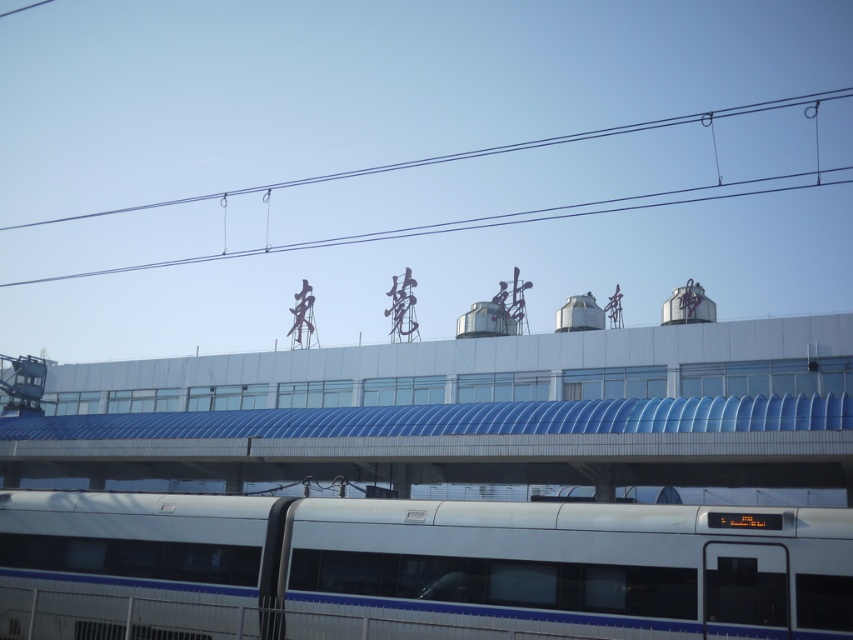
Question: Can you confirm if white glossy passenger train at bottom is positioned above black wire at upper center?

Choices:
 (A) yes
 (B) no

Answer: (B)

Question: Is white glossy passenger train at bottom closer to the viewer compared to black wire at upper center?

Choices:
 (A) no
 (B) yes

Answer: (B)

Question: Which point is farther to the camera?

Choices:
 (A) (453, 595)
 (B) (387, 168)

Answer: (B)

Question: Observing the image, what is the correct spatial positioning of white glossy passenger train at bottom in reference to black wire at upper center?

Choices:
 (A) above
 (B) below

Answer: (B)